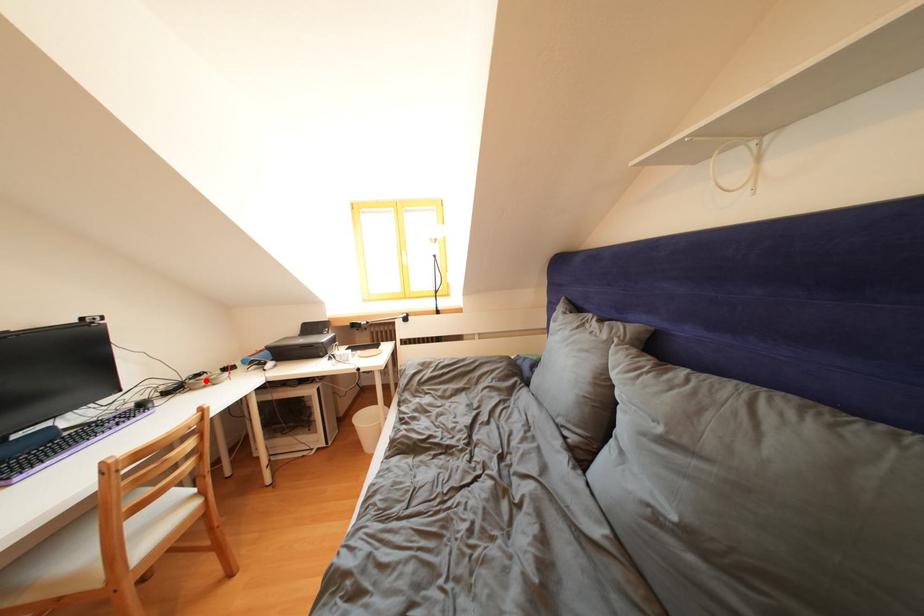
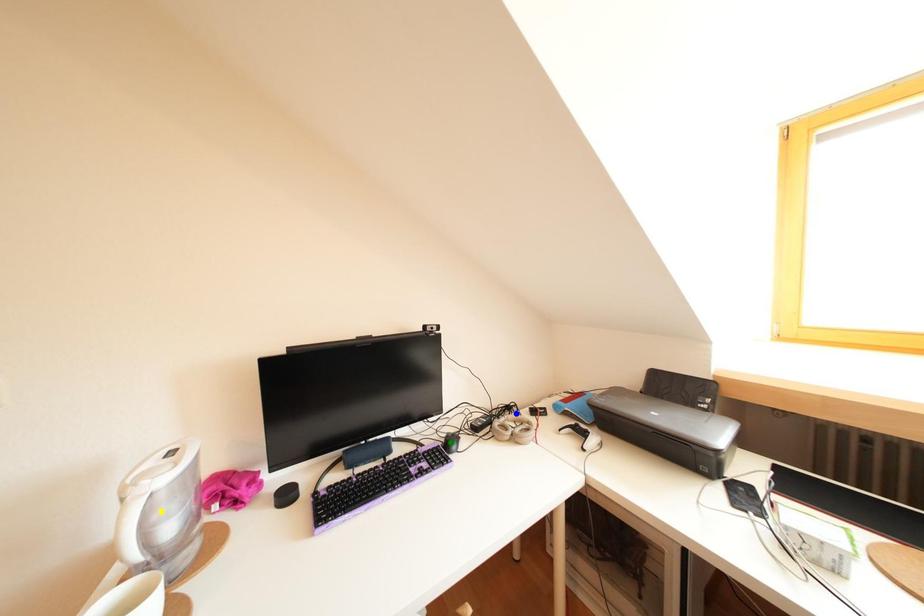
Question: I am providing you with two images of the same scene from different viewpoints. A red point is marked on the first image. You are given multiple points on the second image. Can you choose the point in image 2 that corresponds to the point in image 1?

Choices:
 (A) blue point
 (B) green point
 (C) yellow point

Answer: (A)